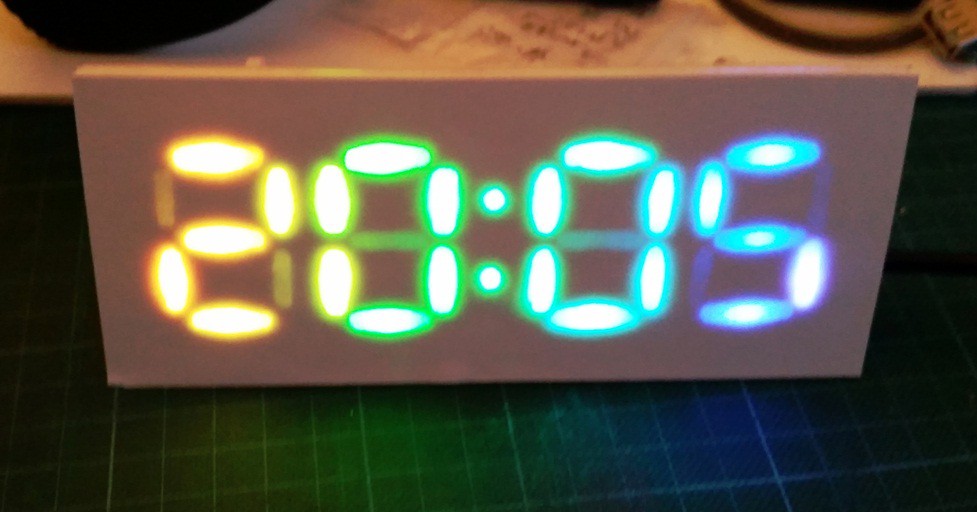
This screenshot has height=512, width=977. Find the location of `gray digital clock panel`. gray digital clock panel is located at coordinates (89, 93).